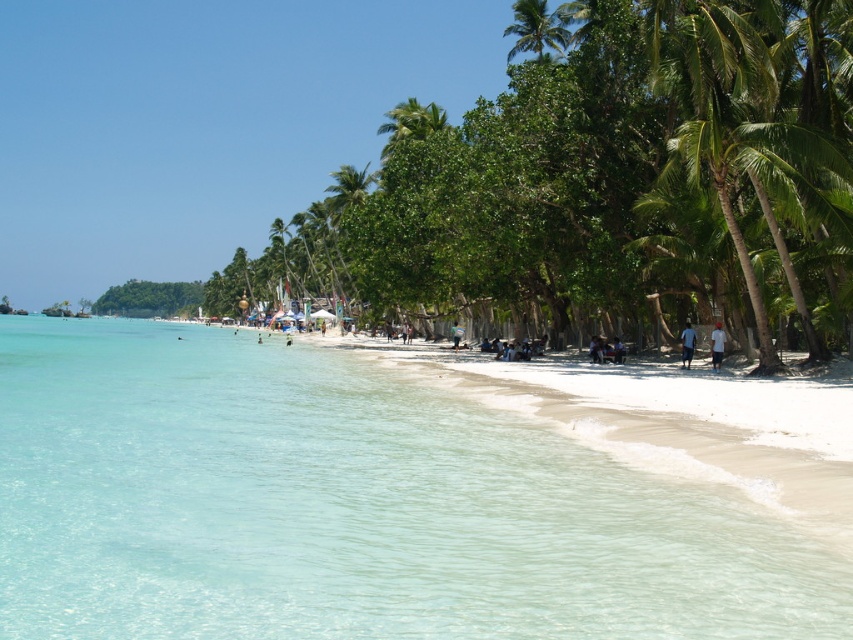
Question: Is green leafy palm tree at upper right thinner than white matte shirt at lower right?

Choices:
 (A) yes
 (B) no

Answer: (B)

Question: Can you confirm if blue fabric shirt at lower right is bigger than white fabric umbrella at center?

Choices:
 (A) yes
 (B) no

Answer: (A)

Question: Which object appears closest to the camera in this image?

Choices:
 (A) blue fabric shirt at lower right
 (B) white fabric umbrella at center

Answer: (A)

Question: Estimate the real-world distances between objects in this image. Which object is closer to the green leafy palm tree at upper right?

Choices:
 (A) blue fabric shirt at lower right
 (B) white matte shirt at lower right

Answer: (B)

Question: From the image, what is the correct spatial relationship of clear water at beach right in relation to green leafy palm tree at upper right?

Choices:
 (A) below
 (B) above

Answer: (A)

Question: Which point appears closest to the camera in this image?

Choices:
 (A) (717, 323)
 (B) (454, 346)
 (C) (407, 556)
 (D) (540, 13)

Answer: (C)